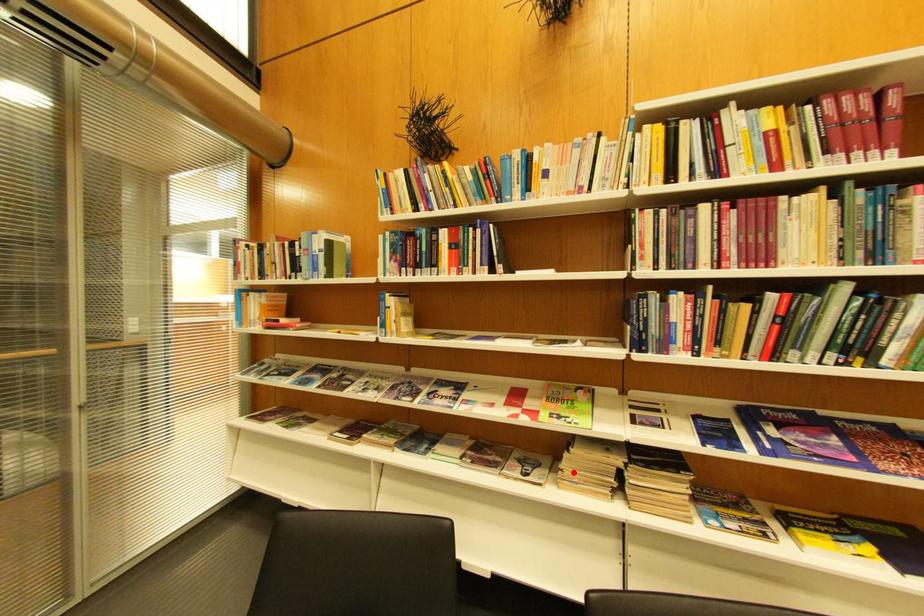
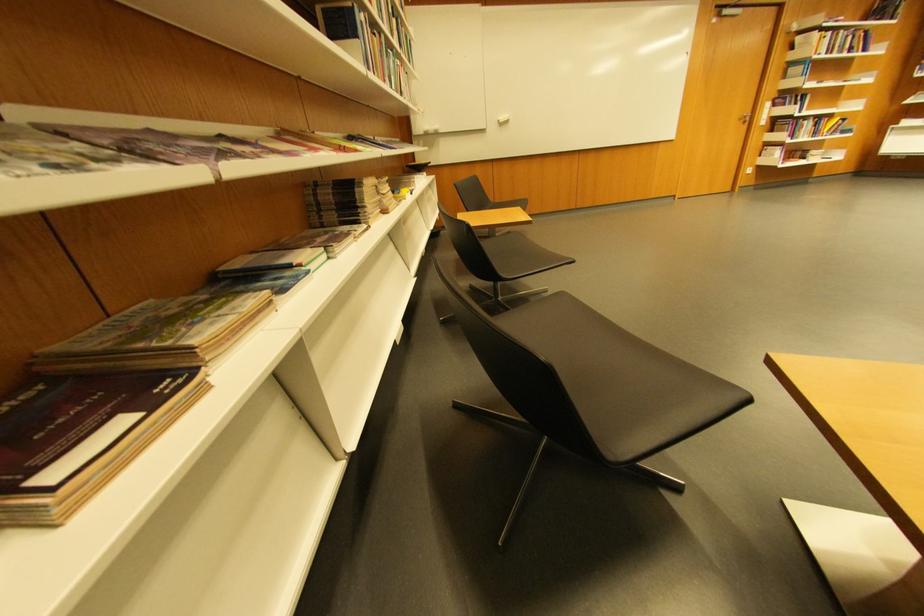
Question: I am providing you with two images of the same scene from different viewpoints. A red point is shown in image1. For the corresponding object point in image2, is it positioned nearer or farther from the camera?

Choices:
 (A) Nearer
 (B) Farther

Answer: (A)